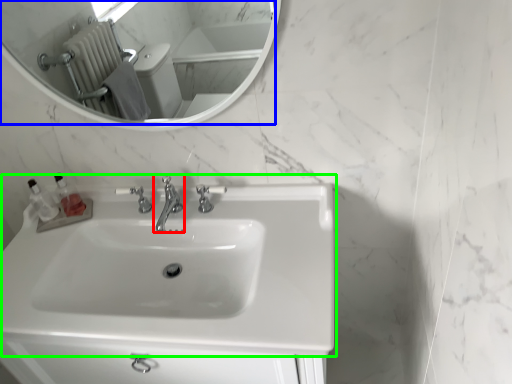
Question: Estimate the real-world distances between objects in this image. Which object is closer to tap (highlighted by a red box), mirror (highlighted by a blue box) or sink (highlighted by a green box)?

Choices:
 (A) mirror
 (B) sink

Answer: (B)